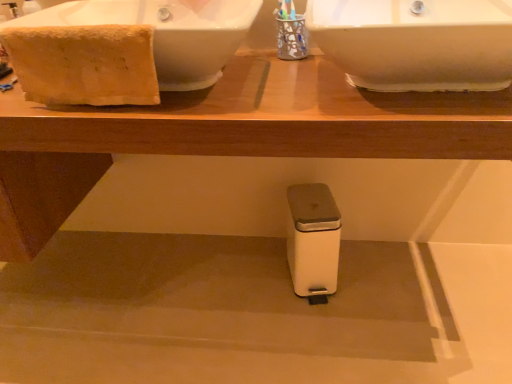
I want to click on vacant space that is in between white glossy sink at upper left, which is counted as the first sink, starting from the left, and white glossy sink at upper right, the 2th sink from the left, so click(x=279, y=83).